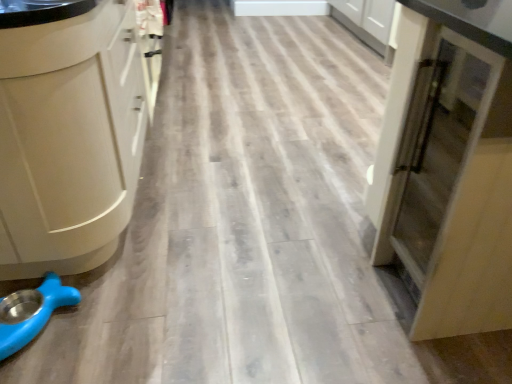
Question: From a real-world perspective, is blue rubber pet bowl at lower left positioned over matte wood cupboard at right based on gravity?

Choices:
 (A) no
 (B) yes

Answer: (A)

Question: Considering the relative sizes of blue rubber pet bowl at lower left and matte wood cupboard at right in the image provided, is blue rubber pet bowl at lower left smaller than matte wood cupboard at right?

Choices:
 (A) yes
 (B) no

Answer: (A)

Question: Could you tell me if blue rubber pet bowl at lower left is facing matte wood cupboard at right?

Choices:
 (A) yes
 (B) no

Answer: (B)

Question: Is blue rubber pet bowl at lower left not near matte wood cupboard at right?

Choices:
 (A) yes
 (B) no

Answer: (A)

Question: From a real-world perspective, does blue rubber pet bowl at lower left sit lower than matte wood cupboard at right?

Choices:
 (A) no
 (B) yes

Answer: (B)

Question: From the image's perspective, is matte wood cupboard at right above or below matte white cabinet at left?

Choices:
 (A) below
 (B) above

Answer: (A)

Question: Is matte wood cupboard at right taller or shorter than matte white cabinet at left?

Choices:
 (A) tall
 (B) short

Answer: (B)

Question: From a real-world perspective, is matte wood cupboard at right above or below matte white cabinet at left?

Choices:
 (A) above
 (B) below

Answer: (B)

Question: Considering the positions of matte wood cupboard at right and matte white cabinet at left in the image, is matte wood cupboard at right wider or thinner than matte white cabinet at left?

Choices:
 (A) wide
 (B) thin

Answer: (B)

Question: From the image's perspective, is matte wood cupboard at right above or below blue rubber pet bowl at lower left?

Choices:
 (A) below
 (B) above

Answer: (B)

Question: In terms of height, does matte wood cupboard at right look taller or shorter compared to blue rubber pet bowl at lower left?

Choices:
 (A) tall
 (B) short

Answer: (A)

Question: Considering the positions of matte wood cupboard at right and blue rubber pet bowl at lower left in the image, is matte wood cupboard at right wider or thinner than blue rubber pet bowl at lower left?

Choices:
 (A) thin
 (B) wide

Answer: (B)

Question: Looking at the image, does matte wood cupboard at right seem bigger or smaller compared to blue rubber pet bowl at lower left?

Choices:
 (A) big
 (B) small

Answer: (A)

Question: Does point (118, 125) appear closer or farther from the camera than point (69, 291)?

Choices:
 (A) farther
 (B) closer

Answer: (A)

Question: In terms of size, does matte white cabinet at left appear bigger or smaller than blue rubber pet bowl at lower left?

Choices:
 (A) small
 (B) big

Answer: (B)